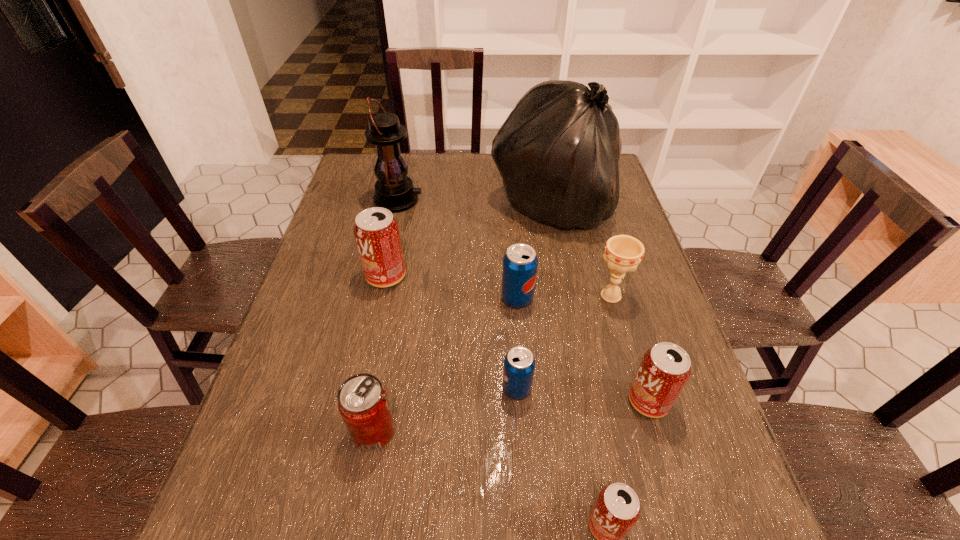
Locate which red soda can is the closest to the tallest soda can. Please provide its 2D coordinates. Your answer should be formatted as a tuple, i.e. [(x, y)], where the tuple contains the x and y coordinates of a point satisfying the conditions above.

[(363, 403)]

You are a GUI agent. You are given a task and a screenshot of the screen. Output one action in this format:
    pyautogui.click(x=<x>, y=<y>)
    Task: Click on the red soda can that is the closest to the lantern
    
    Given the screenshot: What is the action you would take?
    pyautogui.click(x=376, y=231)

Find the location of a particular element. This screenshot has height=540, width=960. free space that satisfies the following two spatial constraints: 1. above the smaller blue pop soda, indicating its light source; 2. on the right side of the eighth shortest object is located at coordinates (356, 389).

Identify the location of free space that satisfies the following two spatial constraints: 1. on the back side of the farthest red soda can; 2. above the eighth shortest object, indicating its light source. (402, 200).

Identify the location of free spot that satisfies the following two spatial constraints: 1. above the second tallest object, indicating its light source; 2. on the back side of the rightmost soda can. The image size is (960, 540). (353, 401).

The width and height of the screenshot is (960, 540). In order to click on vacant area that satisfies the following two spatial constraints: 1. on the back side of the chalice; 2. on the left side of the farther blue pop soda in this screenshot , I will do `click(517, 296)`.